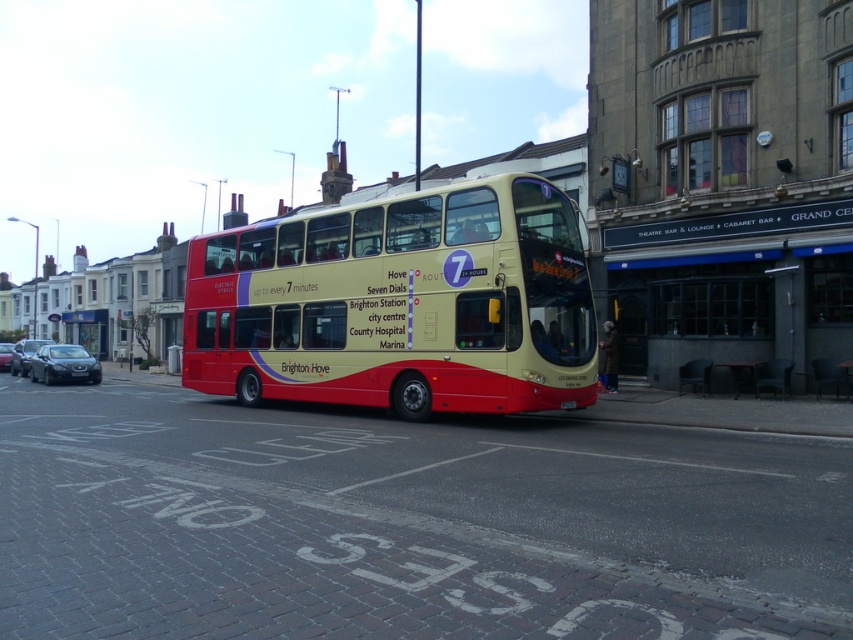
Can you confirm if shiny black sedan at center is shorter than red plastic license plate at center?

In fact, shiny black sedan at center may be taller than red plastic license plate at center.

From the picture: Which of these two, shiny black sedan at center or red plastic license plate at center, stands taller?

Standing taller between the two is shiny black sedan at center.

This screenshot has width=853, height=640. What do you see at coordinates (4, 355) in the screenshot?
I see `shiny black sedan at center` at bounding box center [4, 355].

You are a GUI agent. You are given a task and a screenshot of the screen. Output one action in this format:
    pyautogui.click(x=<x>, y=<y>)
    Task: Click on the shiny black sedan at center
    
    Given the screenshot: What is the action you would take?
    pyautogui.click(x=4, y=355)

Is point (349, 252) positioned before point (7, 349)?

Yes, it is in front of point (7, 349).

Is matte red bus at center bigger than shiny black sedan at center?

Answer: Yes.

Between point (334, 266) and point (0, 364), which one is positioned in front?

Point (334, 266)

Locate an element on the screen. matte red bus at center is located at coordinates (399, 304).

Does metallic silver car at left come in front of red plastic license plate at center?

No, it is not.

Looking at this image, is metallic silver car at left positioned at the back of red plastic license plate at center?

Yes, metallic silver car at left is behind red plastic license plate at center.

Which is in front, point (10, 362) or point (575, 404)?

Point (575, 404) is more forward.

Locate an element on the screen. The image size is (853, 640). metallic silver car at left is located at coordinates (25, 355).